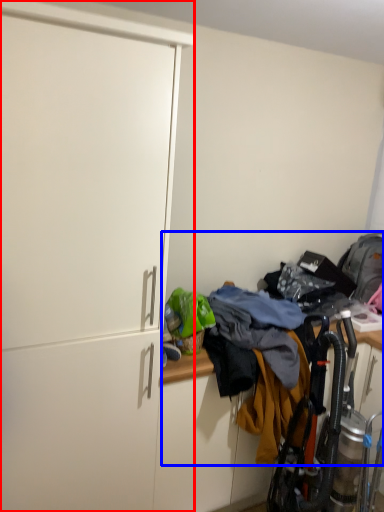
Question: Which point is closer to the camera, cabinetry (highlighted by a red box) or laundry (highlighted by a blue box)?

Choices:
 (A) cabinetry
 (B) laundry

Answer: (A)